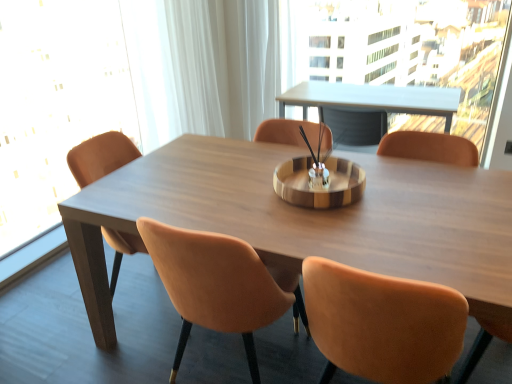
Question: Considering the relative positions of matte brown chair at center and transparent glass window screen at left in the image provided, is matte brown chair at center to the right of transparent glass window screen at left from the viewer's perspective?

Choices:
 (A) yes
 (B) no

Answer: (A)

Question: Is matte brown chair at center touching transparent glass window screen at left?

Choices:
 (A) yes
 (B) no

Answer: (B)

Question: Is matte brown chair at center completely or partially outside of transparent glass window screen at left?

Choices:
 (A) yes
 (B) no

Answer: (A)

Question: Is the position of matte brown chair at center less distant than that of transparent glass window screen at left?

Choices:
 (A) yes
 (B) no

Answer: (A)

Question: Does matte brown chair at center have a greater height compared to transparent glass window screen at left?

Choices:
 (A) yes
 (B) no

Answer: (B)

Question: Considering the positions of point (118, 140) and point (41, 170), is point (118, 140) closer or farther from the camera than point (41, 170)?

Choices:
 (A) closer
 (B) farther

Answer: (A)

Question: In terms of height, does matte brown chair at center look taller or shorter compared to transparent glass window screen at left?

Choices:
 (A) tall
 (B) short

Answer: (B)

Question: In the image, is matte brown chair at center on the left side or the right side of transparent glass window screen at left?

Choices:
 (A) right
 (B) left

Answer: (A)

Question: Would you say matte brown chair at center is inside or outside transparent glass window screen at left?

Choices:
 (A) inside
 (B) outside

Answer: (B)

Question: Is matte brown chair at center taller or shorter than wooden table at center?

Choices:
 (A) tall
 (B) short

Answer: (A)

Question: Is matte brown chair at center spatially inside wooden table at center, or outside of it?

Choices:
 (A) inside
 (B) outside

Answer: (A)

Question: From the image's perspective, is matte brown chair at center positioned above or below wooden table at center?

Choices:
 (A) below
 (B) above

Answer: (A)

Question: Is point (124, 235) positioned closer to the camera than point (401, 210)?

Choices:
 (A) closer
 (B) farther

Answer: (B)

Question: Is transparent glass window screen at left bigger or smaller than wooden table at center?

Choices:
 (A) big
 (B) small

Answer: (B)

Question: Is transparent glass window screen at left spatially inside wooden table at center, or outside of it?

Choices:
 (A) outside
 (B) inside

Answer: (A)